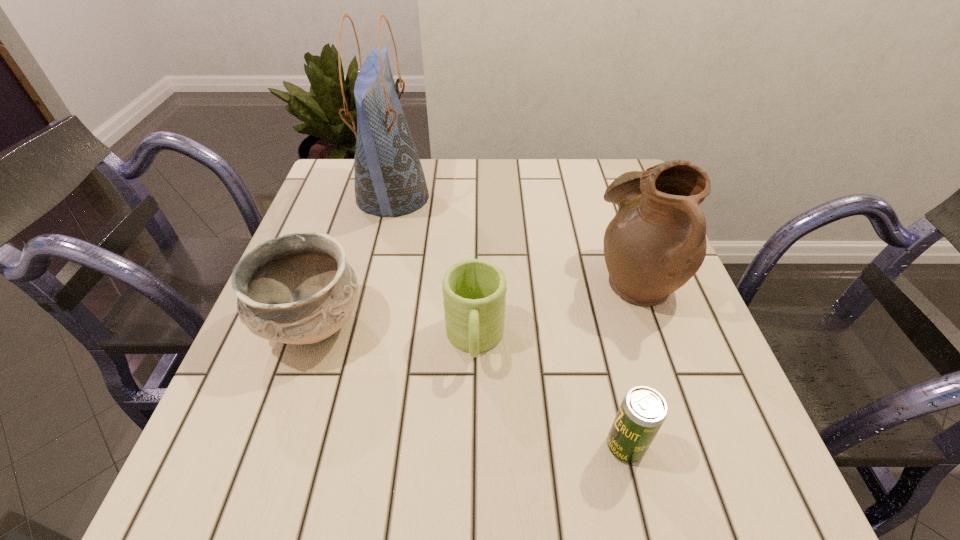
This screenshot has width=960, height=540. In order to click on empty location between the farthest object and the fourth shortest object in this screenshot , I will do `click(515, 238)`.

Identify the location of free spot between the fourth shortest object and the shopping bag. Image resolution: width=960 pixels, height=540 pixels. (515, 238).

Where is `the closest object to the pitcher`? Image resolution: width=960 pixels, height=540 pixels. the closest object to the pitcher is located at coordinates (474, 291).

Locate an element on the screen. The height and width of the screenshot is (540, 960). the second closest object relative to the pitcher is located at coordinates (643, 410).

This screenshot has width=960, height=540. I want to click on vacant region that satisfies the following two spatial constraints: 1. on the side of the third object from right to left with the handle; 2. on the right side of the beer can, so click(473, 447).

The height and width of the screenshot is (540, 960). I want to click on vacant region that satisfies the following two spatial constraints: 1. on the back side of the shopping bag; 2. on the left side of the pottery, so click(357, 197).

Identify the location of blank space that satisfies the following two spatial constraints: 1. on the front side of the farthest object; 2. on the left side of the beer can. Image resolution: width=960 pixels, height=540 pixels. (332, 447).

The width and height of the screenshot is (960, 540). Find the location of `free space that satisfies the following two spatial constraints: 1. on the back side of the farthest object; 2. on the right side of the pottery`. free space that satisfies the following two spatial constraints: 1. on the back side of the farthest object; 2. on the right side of the pottery is located at coordinates (357, 197).